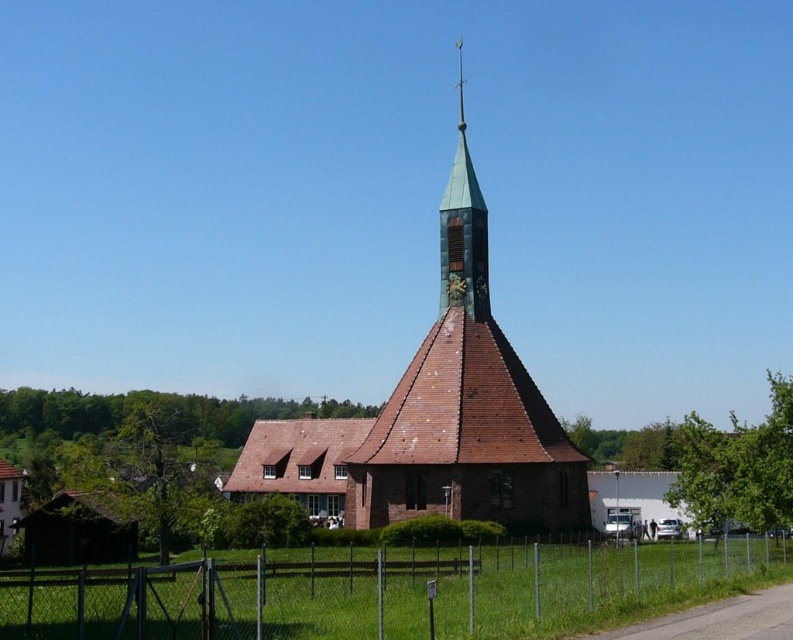
Does metallic chain-link fence at lower center come behind brown brick church at center?

No, it is in front of brown brick church at center.

This screenshot has height=640, width=793. Describe the element at coordinates (382, 593) in the screenshot. I see `metallic chain-link fence at lower center` at that location.

This screenshot has width=793, height=640. Identify the location of metallic chain-link fence at lower center. (382, 593).